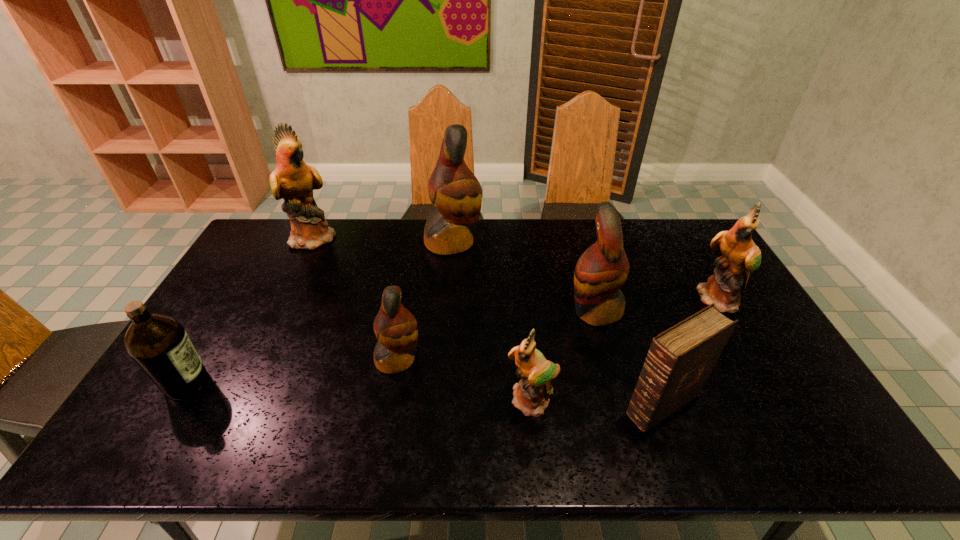
The width and height of the screenshot is (960, 540). Find the location of `vacant point that satisfies the following two spatial constraints: 1. on the front-facing side of the rightmost green parrot; 2. on the face of the smallest red parrot`. vacant point that satisfies the following two spatial constraints: 1. on the front-facing side of the rightmost green parrot; 2. on the face of the smallest red parrot is located at coordinates (756, 359).

Find the location of a particular element. vacant space that satisfies the following two spatial constraints: 1. on the face of the rightmost red parrot; 2. on the front-facing side of the fourth parrot from left to right is located at coordinates (620, 401).

This screenshot has height=540, width=960. I want to click on free point that satisfies the following two spatial constraints: 1. on the face of the nearest red parrot; 2. on the left side of the Bible, so click(390, 405).

In order to click on vacant space that satisfies the following two spatial constraints: 1. on the label of the leftmost object; 2. on the left side of the Bible in this screenshot , I will do `click(173, 405)`.

In order to click on vacant space that satisfies the following two spatial constraints: 1. on the face of the rightmost red parrot; 2. on the front-facing side of the smallest green parrot in this screenshot , I will do `click(620, 401)`.

The height and width of the screenshot is (540, 960). Identify the location of free space that satisfies the following two spatial constraints: 1. on the back side of the Bible; 2. on the face of the rightmost red parrot. [629, 310].

This screenshot has width=960, height=540. In order to click on free spot that satisfies the following two spatial constraints: 1. on the front-facing side of the rightmost green parrot; 2. on the face of the second smallest red parrot in this screenshot , I will do `click(727, 310)`.